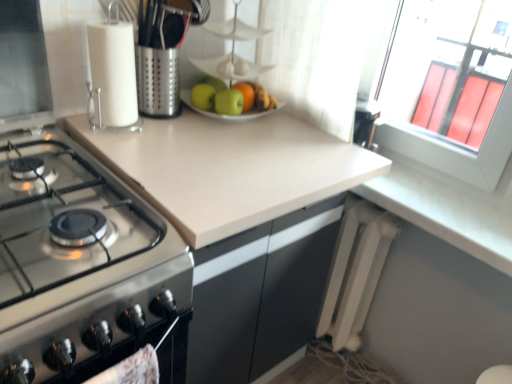
You are a GUI agent. You are given a task and a screenshot of the screen. Output one action in this format:
    pyautogui.click(x=<x>, y=<y>)
    Task: Click on the glossy orange at center
    The image size is (512, 384).
    Given the screenshot: What is the action you would take?
    pyautogui.click(x=245, y=94)

The width and height of the screenshot is (512, 384). What do you see at coordinates (203, 96) in the screenshot?
I see `green matte apple at center, the 2th apple in the right-to-left sequence` at bounding box center [203, 96].

Measure the distance between stainless steel gas stove at left and camera.

A distance of 56.90 centimeters exists between stainless steel gas stove at left and camera.

Describe the element at coordinates (112, 77) in the screenshot. I see `white paper towel holder at upper left` at that location.

Measure the distance between point [426,187] and camera.

Point [426,187] and camera are 4.09 feet apart from each other.

Identify the location of green matte apple at center, which is the second apple in left-to-right order. The image size is (512, 384). (229, 102).

The height and width of the screenshot is (384, 512). I want to click on glossy orange at center, so click(x=245, y=94).

How different are the orientations of green matte apple at center, which is the 1th apple from right to left, and glossy orange at center in degrees?

The angular difference between green matte apple at center, which is the 1th apple from right to left, and glossy orange at center is 8.22e-05 degrees.

Is green matte apple at center, which is the 1th apple from right to left, behind glossy orange at center?

No, it is in front of glossy orange at center.

Could you tell me if green matte apple at center, which is the 1th apple from right to left, is turned towards glossy orange at center?

No.

Who is shorter, green matte apple at center, which is the 1th apple from right to left, or glossy orange at center?

Standing shorter between the two is green matte apple at center, which is the 1th apple from right to left.

From a real-world perspective, which object rests below the other?

white plastic radiator at lower right, from a real-world perspective.

Find the location of a particular element. orange on the left of white plastic radiator at lower right is located at coordinates (245, 94).

Can you confirm if glossy orange at center is smaller than white plastic radiator at lower right?

Answer: Yes.

From the image's perspective, is glossy orange at center above or below white plastic radiator at lower right?

glossy orange at center is above white plastic radiator at lower right.

Which point is more forward, (415, 188) or (230, 113)?

The point (230, 113) is closer to the camera.

Where is `counter top on the right of green matte apple at center, which is the 1th apple from right to left`? counter top on the right of green matte apple at center, which is the 1th apple from right to left is located at coordinates pyautogui.click(x=448, y=208).

In the scene shown: Would you say green matte apple at center, which is the 1th apple from right to left, is part of white matte counter top at lower right's contents?

No, green matte apple at center, which is the 1th apple from right to left, is not a part of white matte counter top at lower right.

Which is in front, white paper towel holder at upper left or green matte apple at center, the 2th apple in the right-to-left sequence?

Positioned in front is white paper towel holder at upper left.

Can you confirm if white paper towel holder at upper left is thinner than green matte apple at center, the first apple when ordered from left to right?

No.

Does point (95, 104) come behind point (203, 98)?

No, (95, 104) is in front of (203, 98).

From a real-world perspective, does white paper towel holder at upper left sit lower than green matte apple at center, the 2th apple in the right-to-left sequence?

No, from a real-world perspective, white paper towel holder at upper left is not below green matte apple at center, the 2th apple in the right-to-left sequence.

Is green matte apple at center, the first apple when ordered from left to right, with stainless steel gas stove at left?

No, green matte apple at center, the first apple when ordered from left to right, is not touching stainless steel gas stove at left.

Is green matte apple at center, the first apple when ordered from left to right, situated inside stainless steel gas stove at left or outside?

green matte apple at center, the first apple when ordered from left to right, lies outside stainless steel gas stove at left.

From the image's perspective, who appears lower, green matte apple at center, the 2th apple in the right-to-left sequence, or stainless steel gas stove at left?

stainless steel gas stove at left, from the image's perspective.

Does point (204, 109) come farther from viewer compared to point (68, 240)?

Yes.

Looking at this image, how many degrees apart are the facing directions of glossy orange at center and beige laminate countertop at center?

The facing directions of glossy orange at center and beige laminate countertop at center are 0.489 degrees apart.

In the scene shown: Does glossy orange at center lie behind beige laminate countertop at center?

Yes, glossy orange at center is further from the viewer.

Is glossy orange at center next to beige laminate countertop at center?

No, glossy orange at center is not in contact with beige laminate countertop at center.

Which of these two, glossy orange at center or beige laminate countertop at center, is smaller?

With smaller size is glossy orange at center.

Which is in front, point (103, 248) or point (112, 90)?

Positioned in front is point (103, 248).

Where is `kitchen appliance behind the stainless steel gas stove at left`? kitchen appliance behind the stainless steel gas stove at left is located at coordinates (112, 77).

Is stainless steel gas stove at left further to the viewer compared to white paper towel holder at upper left?

No, the depth of stainless steel gas stove at left is less than that of white paper towel holder at upper left.

Considering the relative positions of stainless steel gas stove at left and white paper towel holder at upper left in the image provided, is stainless steel gas stove at left to the right of white paper towel holder at upper left from the viewer's perspective?

No, stainless steel gas stove at left is not to the right of white paper towel holder at upper left.

Which apple is the 1st one when counting from the left side of the glossy orange at center? Please provide its 2D coordinates.

[(229, 102)]

At what (x,y) coordinates should I click in order to perform the action: click on orange above the white plastic radiator at lower right (from a real-world perspective). Please return your answer as a coordinate pair (x, y). Looking at the image, I should click on (245, 94).

Estimate the real-world distances between objects in this image. Which object is closer to glossy orange at center, green matte apple at center, which is the 1th apple from right to left, or white plastic radiator at lower right?

Based on the image, green matte apple at center, which is the 1th apple from right to left, appears to be nearer to glossy orange at center.

Looking at this image, from the image, which object appears to be farther from white plastic radiator at lower right, green matte apple at center, the first apple when ordered from left to right, or green matte apple at center, which is the second apple in left-to-right order?

Among the two, green matte apple at center, the first apple when ordered from left to right, is located further to white plastic radiator at lower right.

From the image, which object appears to be nearer to white paper towel holder at upper left, stainless steel gas stove at left or white plastic radiator at lower right?

stainless steel gas stove at left is positioned closer to the anchor white paper towel holder at upper left.

Estimate the real-world distances between objects in this image. Which object is further from white plastic radiator at lower right, green matte apple at center, which is the 1th apple from right to left, or stainless steel gas stove at left?

The object further to white plastic radiator at lower right is stainless steel gas stove at left.

Estimate the real-world distances between objects in this image. Which object is further from stainless steel gas stove at left, beige laminate countertop at center or green matte apple at center, the first apple when ordered from left to right?

green matte apple at center, the first apple when ordered from left to right, is further to stainless steel gas stove at left.

Considering their positions, is white matte counter top at lower right positioned closer to white paper towel holder at upper left than glossy orange at center?

glossy orange at center is closer to white paper towel holder at upper left.

Which object lies nearer to the anchor point green matte apple at center, which is the second apple in left-to-right order, white plastic radiator at lower right or stainless steel gas stove at left?

Based on the image, stainless steel gas stove at left appears to be nearer to green matte apple at center, which is the second apple in left-to-right order.

Looking at the image, which one is located further to green matte apple at center, which is the 1th apple from right to left, green matte apple at center, the 2th apple in the right-to-left sequence, or white matte counter top at lower right?

Based on the image, white matte counter top at lower right appears to be further to green matte apple at center, which is the 1th apple from right to left.

Identify the location of apple located between beige laminate countertop at center and white matte counter top at lower right in the left-right direction. The height and width of the screenshot is (384, 512). (229, 102).

Where is `countertop between green matte apple at center, the 2th apple in the right-to-left sequence, and white plastic radiator at lower right, in the vertical direction`? countertop between green matte apple at center, the 2th apple in the right-to-left sequence, and white plastic radiator at lower right, in the vertical direction is located at coordinates (330, 196).

What are the coordinates of `apple between stainless steel gas stove at left and green matte apple at center, the 2th apple in the right-to-left sequence, in the front-back direction` in the screenshot? It's located at 229,102.

I want to click on orange between white paper towel holder at upper left and white matte counter top at lower right, so coord(245,94).